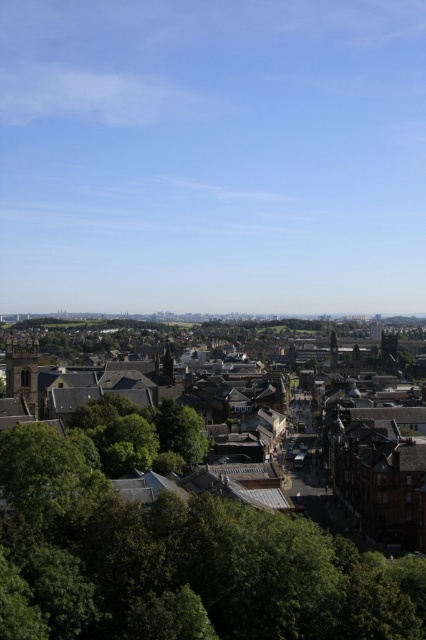
Question: Among these points, which one is farthest from the camera?

Choices:
 (A) (250, 467)
 (B) (28, 387)

Answer: (B)

Question: Which is nearer to the brown stone buildings at center?

Choices:
 (A) green leafy tree at lower left
 (B) brown stone tower at left

Answer: (A)

Question: From the image, what is the correct spatial relationship of green leafy tree at lower left in relation to brown stone buildings at center?

Choices:
 (A) right
 (B) left

Answer: (B)

Question: Is brown stone buildings at center positioned behind brown stone tower at center?

Choices:
 (A) no
 (B) yes

Answer: (A)

Question: Can you confirm if green leafy tree at lower left is thinner than brown stone tower at left?

Choices:
 (A) yes
 (B) no

Answer: (A)

Question: Which point is farther to the camera?

Choices:
 (A) brown stone tower at center
 (B) brown stone tower at left
 (C) green leafy tree at lower left

Answer: (A)